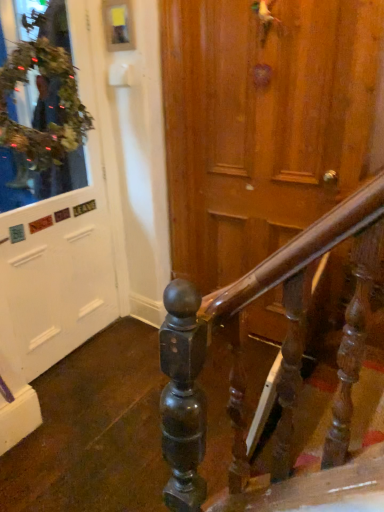
Question: From the image's perspective, is white matte door at left located above or below green leafy wreath at upper left?

Choices:
 (A) below
 (B) above

Answer: (A)

Question: From a real-world perspective, is white matte door at left physically located above or below green leafy wreath at upper left?

Choices:
 (A) below
 (B) above

Answer: (A)

Question: Does point (14, 289) appear closer or farther from the camera than point (46, 98)?

Choices:
 (A) farther
 (B) closer

Answer: (A)

Question: Considering the positions of point (0, 87) and point (41, 303), is point (0, 87) closer or farther from the camera than point (41, 303)?

Choices:
 (A) farther
 (B) closer

Answer: (B)

Question: From the image's perspective, relative to white matte door at left, is green leafy wreath at upper left above or below?

Choices:
 (A) above
 (B) below

Answer: (A)

Question: Is green leafy wreath at upper left inside or outside of white matte door at left?

Choices:
 (A) inside
 (B) outside

Answer: (B)

Question: Visually, is green leafy wreath at upper left positioned to the left or to the right of white matte door at left?

Choices:
 (A) left
 (B) right

Answer: (B)